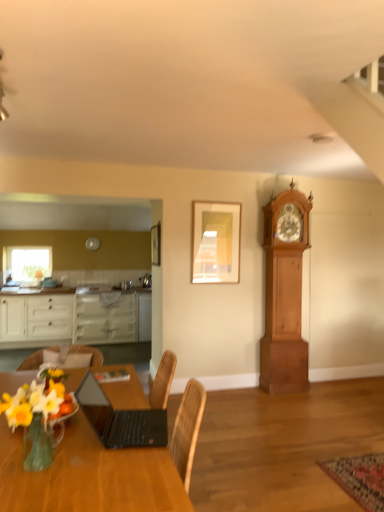
Question: Considering the relative sizes of wooden table at lower left and light brown wooden clock at right in the image provided, is wooden table at lower left wider than light brown wooden clock at right?

Choices:
 (A) no
 (B) yes

Answer: (B)

Question: From the image's perspective, is wooden table at lower left beneath light brown wooden clock at right?

Choices:
 (A) no
 (B) yes

Answer: (B)

Question: Would you say wooden table at lower left contains light brown wooden clock at right?

Choices:
 (A) no
 (B) yes

Answer: (A)

Question: Is wooden table at lower left shorter than light brown wooden clock at right?

Choices:
 (A) no
 (B) yes

Answer: (B)

Question: Can you confirm if wooden table at lower left is taller than light brown wooden clock at right?

Choices:
 (A) no
 (B) yes

Answer: (A)

Question: Is wooden table at lower left at the left side of light brown wooden clock at right?

Choices:
 (A) yes
 (B) no

Answer: (A)

Question: Is the position of white glossy cabinets at left more distant than that of matte wood picture frame at upper center, positioned as the 1th picture frame in left-to-right order?

Choices:
 (A) no
 (B) yes

Answer: (B)

Question: Can you confirm if white glossy cabinets at left is positioned to the left of matte wood picture frame at upper center, positioned as the 1th picture frame in left-to-right order?

Choices:
 (A) yes
 (B) no

Answer: (A)

Question: From a real-world perspective, is white glossy cabinets at left located beneath matte wood picture frame at upper center, the second picture frame in the right-to-left sequence?

Choices:
 (A) yes
 (B) no

Answer: (A)

Question: From the image's perspective, is white glossy cabinets at left below matte wood picture frame at upper center, the second picture frame in the right-to-left sequence?

Choices:
 (A) yes
 (B) no

Answer: (A)

Question: Considering the relative positions of white glossy cabinets at left and matte wood picture frame at upper center, the second picture frame in the right-to-left sequence, in the image provided, is white glossy cabinets at left to the right of matte wood picture frame at upper center, the second picture frame in the right-to-left sequence, from the viewer's perspective?

Choices:
 (A) yes
 (B) no

Answer: (B)

Question: From the image's perspective, is white glossy cabinets at left located above matte wood picture frame at upper center, positioned as the 1th picture frame in left-to-right order?

Choices:
 (A) yes
 (B) no

Answer: (B)

Question: Would you say matte gold picture frame at upper center, arranged as the first picture frame when viewed from the right, contains clear glass window at upper left?

Choices:
 (A) yes
 (B) no

Answer: (B)